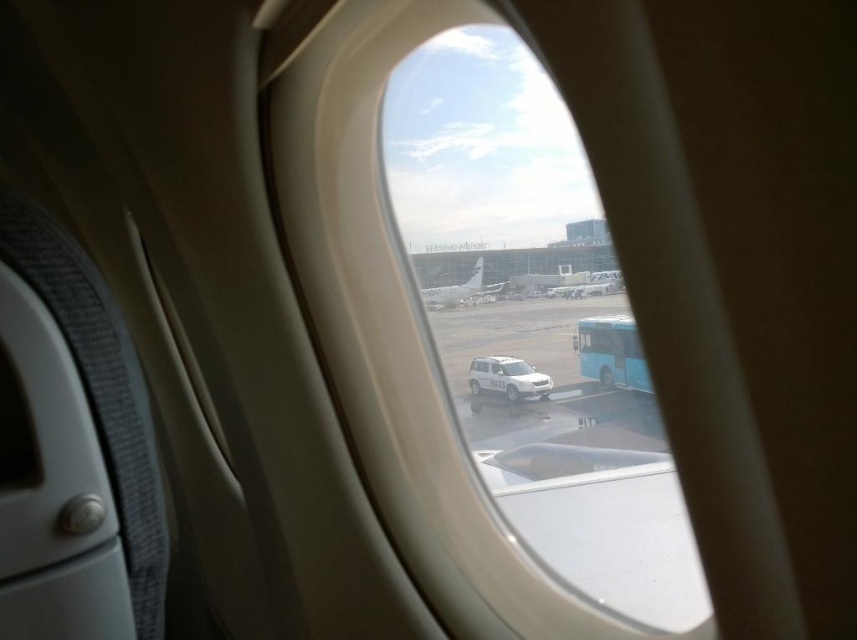
Question: Which point is closer to the camera?

Choices:
 (A) (574, 288)
 (B) (435, 296)

Answer: (B)

Question: Can you confirm if white matte airplane at center is positioned to the left of metallic silver airplane at center?

Choices:
 (A) no
 (B) yes

Answer: (B)

Question: Which point is closer to the camera?

Choices:
 (A) white matte airplane at center
 (B) metallic silver airplane at center

Answer: (B)

Question: Is white matte airplane at center wider than metallic silver airplane at center?

Choices:
 (A) no
 (B) yes

Answer: (A)

Question: Is white matte airplane at center below metallic silver airplane at center?

Choices:
 (A) no
 (B) yes

Answer: (A)